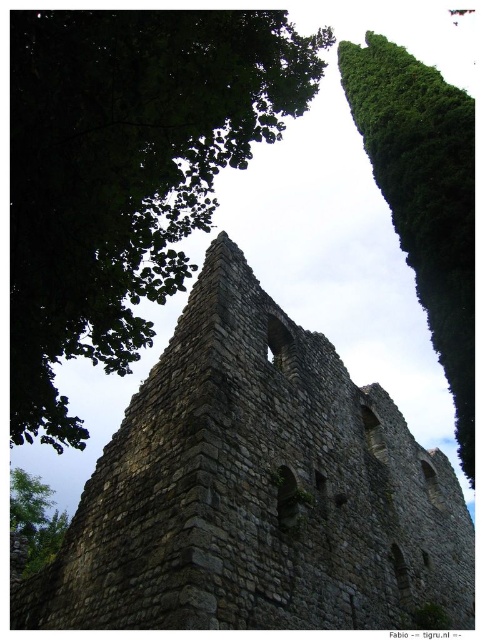
Question: Is the position of stone wall at center less distant than that of green leafy tree at upper right?

Choices:
 (A) yes
 (B) no

Answer: (A)

Question: Estimate the real-world distances between objects in this image. Which object is farther from the green leafy tree at upper right?

Choices:
 (A) green leafy tree at lower left
 (B) stone wall at center
 (C) green leafy tree at upper left

Answer: (A)

Question: Can you confirm if green leafy tree at upper left is bigger than green leafy tree at upper right?

Choices:
 (A) no
 (B) yes

Answer: (A)

Question: Does stone wall at center appear on the left side of green leafy tree at upper left?

Choices:
 (A) yes
 (B) no

Answer: (B)

Question: Which of these objects is positioned closest to the green leafy tree at upper left?

Choices:
 (A) green leafy tree at lower left
 (B) stone wall at center
 (C) green leafy tree at upper right

Answer: (B)

Question: Among these objects, which one is nearest to the camera?

Choices:
 (A) green leafy tree at lower left
 (B) green leafy tree at upper right

Answer: (B)